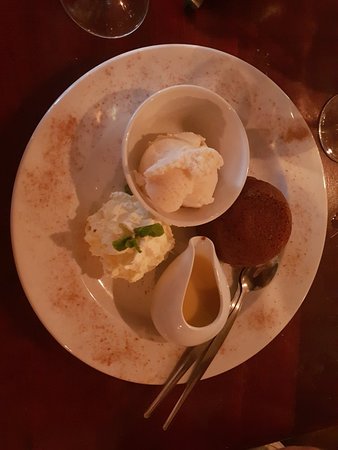
Locate an element on the screen. The image size is (338, 450). bowl is located at coordinates (222, 128).